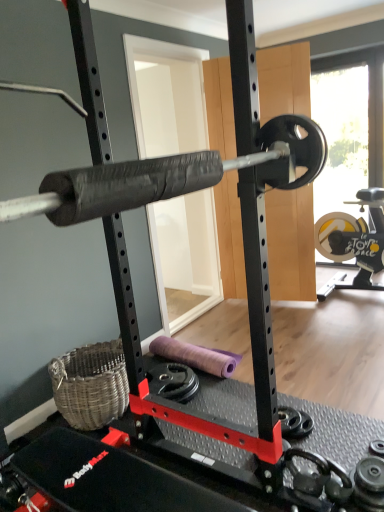
Identify the location of vacant space behind black rubber dumbbell at lower right. The height and width of the screenshot is (512, 384). (294, 401).